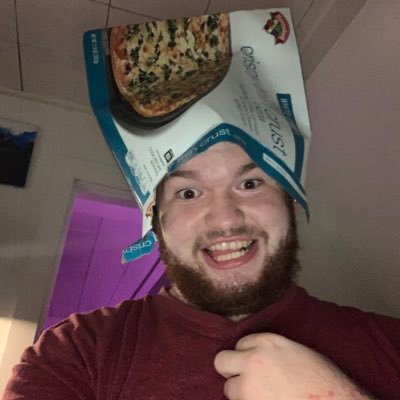
Image resolution: width=400 pixels, height=400 pixels. What are the coordinates of `ceiling` in the screenshot? It's located at (41, 72).